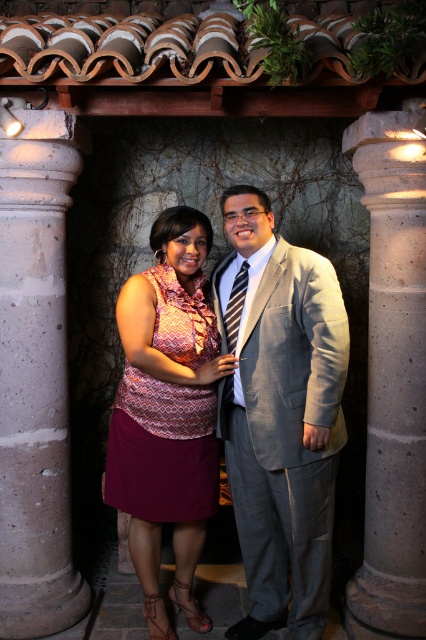
You are a photographer setting up for a ceremony at the venue. You need to place a 2 meter tall floral arrangement between the concrete column at left and the gray concrete column at center. Can you fit it there without blocking the columns?

The concrete column at left is positioned under the gray concrete column at center, meaning they are vertically aligned. Since the floral arrangement is 2 meters tall, it can be placed between them horizontally without blocking the columns as they are stacked vertically.

You are a photographer at a wedding venue. You need to adjust the lighting so that the matte pink dress at center is highlighted while the striped fabric tie at center is less visible. Based on their positions, is this possible?

Yes, since the matte pink dress at center is in front of the striped fabric tie at center, you can adjust the lighting to focus on the dress while the tie remains in the background and less visible.

You are standing at the point marked as point (40, 340) in the image. You want to take a photo of the two people in the scene. Since you are 3.07 meters away from the point, will you be able to capture both individuals in the frame?

The distance of point (40, 340) from viewer is 3.07 meters. Since both individuals are within the same scene and the distance is sufficient, you can capture both in the frame.